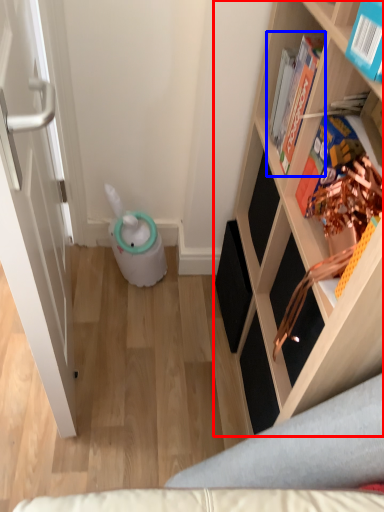
Question: Which object appears farthest to the camera in this image, shelf (highlighted by a red box) or book (highlighted by a blue box)?

Choices:
 (A) shelf
 (B) book

Answer: (B)